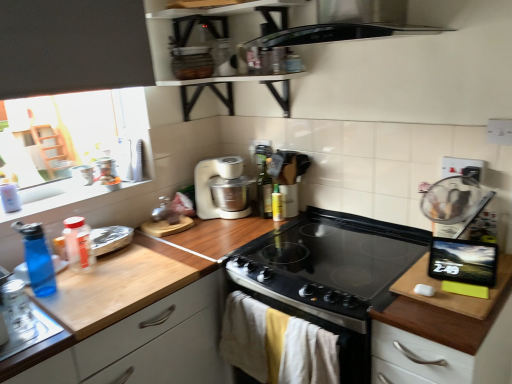
This screenshot has height=384, width=512. What do you see at coordinates (445, 333) in the screenshot?
I see `wooden cutting board at right` at bounding box center [445, 333].

Find the location of a particular element. The height and width of the screenshot is (384, 512). translucent plastic bottle at left, which appears as the 2th bottle when viewed from the left is located at coordinates (78, 244).

This screenshot has height=384, width=512. Describe the element at coordinates (338, 252) in the screenshot. I see `black glass gas stove at center` at that location.

Describe the element at coordinates (17, 308) in the screenshot. I see `clear glass jar at left` at that location.

In order to face clear glass jar at left, should I rotate leftwards or rightwards?

To face it directly, rotate left by 28.922 degrees.

What do you see at coordinates (277, 204) in the screenshot? I see `yellow matte bottle at center, the first bottle when ordered from right to left` at bounding box center [277, 204].

You are a GUI agent. You are given a task and a screenshot of the screen. Output one action in this format:
    pyautogui.click(x=<x>, y=<y>)
    Task: Click on the blue translucent bottle at left, placed as the 1th bottle when sorted from left to right
    This screenshot has height=384, width=512.
    Given the screenshot: What is the action you would take?
    pyautogui.click(x=37, y=259)

Where is `wooden cutting board at right`? This screenshot has height=384, width=512. wooden cutting board at right is located at coordinates (445, 333).

Does white matte food processor at center have a lesser height compared to translucent plastic bottle at left, which appears as the third bottle when viewed from the back?

In fact, white matte food processor at center may be taller than translucent plastic bottle at left, which appears as the third bottle when viewed from the back.

Could you tell me if white matte food processor at center is facing translucent plastic bottle at left, arranged as the second bottle when viewed from the front?

No, white matte food processor at center is not facing towards translucent plastic bottle at left, arranged as the second bottle when viewed from the front.

Is white matte food processor at center bigger or smaller than translucent plastic bottle at left, which appears as the 2th bottle when viewed from the left?

white matte food processor at center is bigger than translucent plastic bottle at left, which appears as the 2th bottle when viewed from the left.

From the image's perspective, between yellow matte bottle at center, which is counted as the 2th bottle, starting from the back, and black glass gas stove at center, who is located below?

black glass gas stove at center.

Is yellow matte bottle at center, the first bottle when ordered from right to left, far from black glass gas stove at center?

No.

From a real-world perspective, which object stands above the other?

yellow matte bottle at center, which is counted as the 2th bottle, starting from the back, is physically above.

Between yellow matte bottle at center, which is counted as the 2th bottle, starting from the back, and black glass gas stove at center, which one has more height?

yellow matte bottle at center, which is counted as the 2th bottle, starting from the back, is taller.

Is blue translucent bottle at left, acting as the fourth bottle starting from the right, positioned with its back to matte black shelf at upper center?

No, blue translucent bottle at left, acting as the fourth bottle starting from the right, is not facing the opposite direction of matte black shelf at upper center.

How many degrees apart are the facing directions of blue translucent bottle at left, the fourth bottle from the back, and matte black shelf at upper center?

The angle between the facing direction of blue translucent bottle at left, the fourth bottle from the back, and the facing direction of matte black shelf at upper center is 88.1 degrees.

Which point is more forward, (40, 224) or (161, 48)?

Point (40, 224)

How distant is translucent plastic bottle at left, arranged as the second bottle when viewed from the front, from wooden cutting board at right?

The distance of translucent plastic bottle at left, arranged as the second bottle when viewed from the front, from wooden cutting board at right is 3.98 feet.

Which of these two, translucent plastic bottle at left, the third bottle when ordered from right to left, or wooden cutting board at right, is wider?

With larger width is wooden cutting board at right.

Is translucent plastic bottle at left, which appears as the 2th bottle when viewed from the left, positioned with its back to wooden cutting board at right?

translucent plastic bottle at left, which appears as the 2th bottle when viewed from the left, does not have its back to wooden cutting board at right.

From a real-world perspective, which is physically below, yellow matte bottle at center, acting as the 3th bottle starting from the front, or white matte food processor at center?

yellow matte bottle at center, acting as the 3th bottle starting from the front, is physically lower.

Can you tell me how much yellow matte bottle at center, marked as the 4th bottle in a left-to-right arrangement, and white matte food processor at center differ in facing direction?

There is a 81.2-degree angle between the facing directions of yellow matte bottle at center, marked as the 4th bottle in a left-to-right arrangement, and white matte food processor at center.

Is yellow matte bottle at center, the first bottle when ordered from right to left, wider or thinner than white matte food processor at center?

yellow matte bottle at center, the first bottle when ordered from right to left, is thinner than white matte food processor at center.

Is blue translucent bottle at left, placed as the 1th bottle when sorted from left to right, not close to wooden cutting board at right?

blue translucent bottle at left, placed as the 1th bottle when sorted from left to right, is far away from wooden cutting board at right.

Is blue translucent bottle at left, placed as the first bottle when sorted from front to back, wider than wooden cutting board at right?

No.

From the image's perspective, is blue translucent bottle at left, placed as the first bottle when sorted from front to back, above wooden cutting board at right?

Indeed, from the image's perspective, blue translucent bottle at left, placed as the first bottle when sorted from front to back, is shown above wooden cutting board at right.

Is green glass bottle at center, which is counted as the second bottle, starting from the right, outside of clear glass jar at left?

green glass bottle at center, which is counted as the second bottle, starting from the right, lies outside clear glass jar at left's area.

Find the location of a particular element. The image size is (512, 384). appliance that appears in front of the green glass bottle at center, marked as the third bottle in a left-to-right arrangement is located at coordinates (17, 308).

From a real-world perspective, is green glass bottle at center, marked as the 4th bottle in a front-to-back arrangement, physically below clear glass jar at left?

No, from a real-world perspective, green glass bottle at center, marked as the 4th bottle in a front-to-back arrangement, is not beneath clear glass jar at left.

Considering the sizes of objects green glass bottle at center, which ranks as the first bottle in back-to-front order, and clear glass jar at left in the image provided, who is wider, green glass bottle at center, which ranks as the first bottle in back-to-front order, or clear glass jar at left?

Wider between the two is green glass bottle at center, which ranks as the first bottle in back-to-front order.

This screenshot has height=384, width=512. I want to click on home appliance that appears behind the translucent plastic bottle at left, arranged as the second bottle when viewed from the front, so click(x=222, y=188).

Find the location of a particular element. This screenshot has width=512, height=384. the 1st bottle to the left when counting from the black glass gas stove at center is located at coordinates (277, 204).

Which object lies further to the anchor point black glass gas stove at center, blue translucent bottle at left, acting as the fourth bottle starting from the right, or translucent plastic bottle at left, which appears as the third bottle when viewed from the back?

Among the two, blue translucent bottle at left, acting as the fourth bottle starting from the right, is located further to black glass gas stove at center.

Estimate the real-world distances between objects in this image. Which object is closer to blue translucent bottle at left, the fourth bottle from the back, wooden cutting board at right or translucent plastic bottle at left, arranged as the second bottle when viewed from the front?

translucent plastic bottle at left, arranged as the second bottle when viewed from the front, lies closer to blue translucent bottle at left, the fourth bottle from the back, than the other object.

From the image, which object appears to be farther from matte black shelf at upper center, green glass bottle at center, marked as the 4th bottle in a front-to-back arrangement, or clear glass jar at left?

Based on the image, clear glass jar at left appears to be further to matte black shelf at upper center.

Considering their positions, is translucent plastic bottle at left, which appears as the 2th bottle when viewed from the left, positioned further to green glass bottle at center, which is counted as the second bottle, starting from the right, than black glass gas stove at center?

Based on the image, translucent plastic bottle at left, which appears as the 2th bottle when viewed from the left, appears to be further to green glass bottle at center, which is counted as the second bottle, starting from the right.

From the image, which object appears to be nearer to wooden cutting board at right, blue translucent bottle at left, placed as the 1th bottle when sorted from left to right, or black glass gas stove at center?

The object closer to wooden cutting board at right is black glass gas stove at center.

Considering their positions, is blue translucent bottle at left, acting as the fourth bottle starting from the right, positioned further to translucent plastic bottle at left, which appears as the third bottle when viewed from the back, than matte black shelf at upper center?

Among the two, matte black shelf at upper center is located further to translucent plastic bottle at left, which appears as the third bottle when viewed from the back.

Based on their spatial positions, is black glass gas stove at center or white matte food processor at center closer to clear glass jar at left?

white matte food processor at center is positioned closer to the anchor clear glass jar at left.

Looking at the image, which one is located further to wooden cutting board at right, blue translucent bottle at left, the fourth bottle from the back, or matte black shelf at upper center?

Among the two, blue translucent bottle at left, the fourth bottle from the back, is located further to wooden cutting board at right.

Where is `bottle between clear glass jar at left and green glass bottle at center, marked as the third bottle in a left-to-right arrangement`? This screenshot has height=384, width=512. bottle between clear glass jar at left and green glass bottle at center, marked as the third bottle in a left-to-right arrangement is located at coordinates (78, 244).

In order to click on home appliance situated between clear glass jar at left and yellow matte bottle at center, which is counted as the 2th bottle, starting from the back, from left to right in this screenshot , I will do `click(222, 188)`.

Where is `home appliance located between wooden cutting board at right and yellow matte bottle at center, the first bottle when ordered from right to left, in the depth direction`? Image resolution: width=512 pixels, height=384 pixels. home appliance located between wooden cutting board at right and yellow matte bottle at center, the first bottle when ordered from right to left, in the depth direction is located at coordinates (222, 188).

Identify the location of home appliance between matte black shelf at upper center and blue translucent bottle at left, placed as the first bottle when sorted from front to back, from top to bottom. (222, 188).